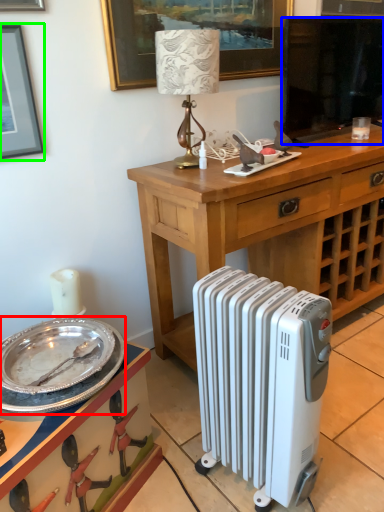
Question: Which object is positioned farthest from plate (highlighted by a red box)? Select from television (highlighted by a blue box) and picture frame (highlighted by a green box).

Choices:
 (A) television
 (B) picture frame

Answer: (A)